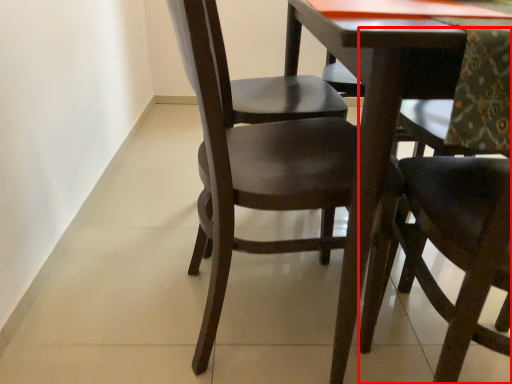
Question: Observing the image, what is the correct spatial positioning of chair (annotated by the red box) in reference to chair?

Choices:
 (A) left
 (B) right

Answer: (B)